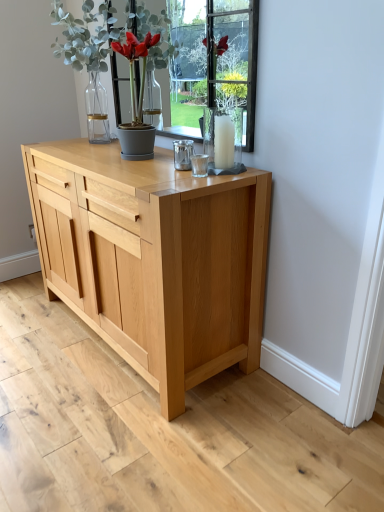
Find the location of a particular element. Image resolution: width=384 pixels, height=512 pixels. free space in front of green matte plant at upper center is located at coordinates (81, 155).